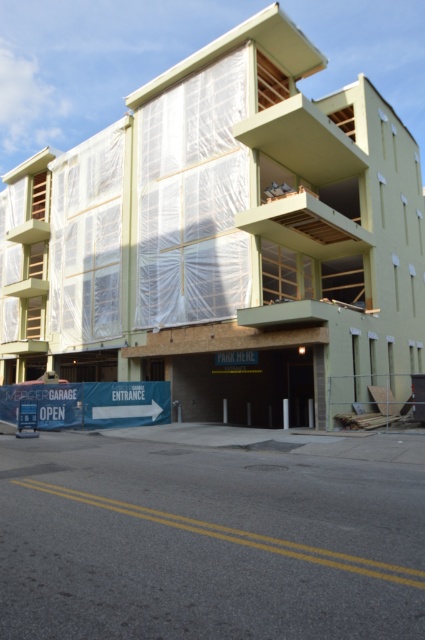
Does green plastic building at center have a lesser width compared to concrete pavement at lower center?

No, green plastic building at center is not thinner than concrete pavement at lower center.

Is green plastic building at center to the right of concrete pavement at lower center from the viewer's perspective?

In fact, green plastic building at center is to the left of concrete pavement at lower center.

Who is more forward, (x=402, y=358) or (x=351, y=536)?

Positioned in front is point (x=351, y=536).

The height and width of the screenshot is (640, 425). Identify the location of green plastic building at center. (224, 241).